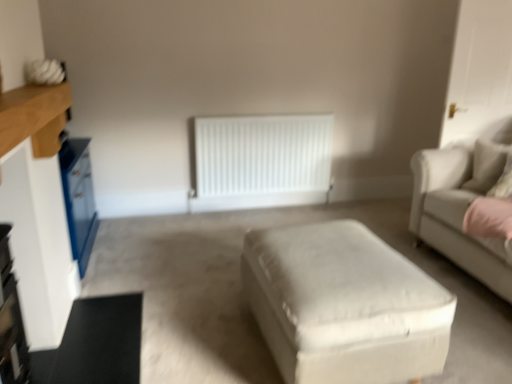
Question: Is white matte radiator at center to the left of white wood entertainment center at left from the viewer's perspective?

Choices:
 (A) no
 (B) yes

Answer: (A)

Question: Is white wood entertainment center at left inside white matte radiator at center?

Choices:
 (A) no
 (B) yes

Answer: (A)

Question: Is white matte radiator at center not near white wood entertainment center at left?

Choices:
 (A) no
 (B) yes

Answer: (B)

Question: Is white matte radiator at center taller than white wood entertainment center at left?

Choices:
 (A) yes
 (B) no

Answer: (A)

Question: From a real-world perspective, does white matte radiator at center stand above white wood entertainment center at left?

Choices:
 (A) yes
 (B) no

Answer: (B)

Question: Is white matte radiator at center facing towards white wood entertainment center at left?

Choices:
 (A) no
 (B) yes

Answer: (B)

Question: Does beige fabric pillow at right appear on the right side of beige fabric couch at right?

Choices:
 (A) yes
 (B) no

Answer: (B)

Question: Is beige fabric couch at right located within beige fabric pillow at right?

Choices:
 (A) no
 (B) yes

Answer: (A)

Question: Is beige fabric pillow at right far away from beige fabric couch at right?

Choices:
 (A) no
 (B) yes

Answer: (A)

Question: From the image's perspective, is beige fabric pillow at right on beige fabric couch at right?

Choices:
 (A) no
 (B) yes

Answer: (B)

Question: Are beige fabric pillow at right and beige fabric couch at right beside each other?

Choices:
 (A) yes
 (B) no

Answer: (B)

Question: Does beige fabric pillow at right appear on the left side of beige fabric couch at right?

Choices:
 (A) no
 (B) yes

Answer: (B)

Question: Is beige fabric couch at right far from white fabric ottoman at center?

Choices:
 (A) no
 (B) yes

Answer: (B)